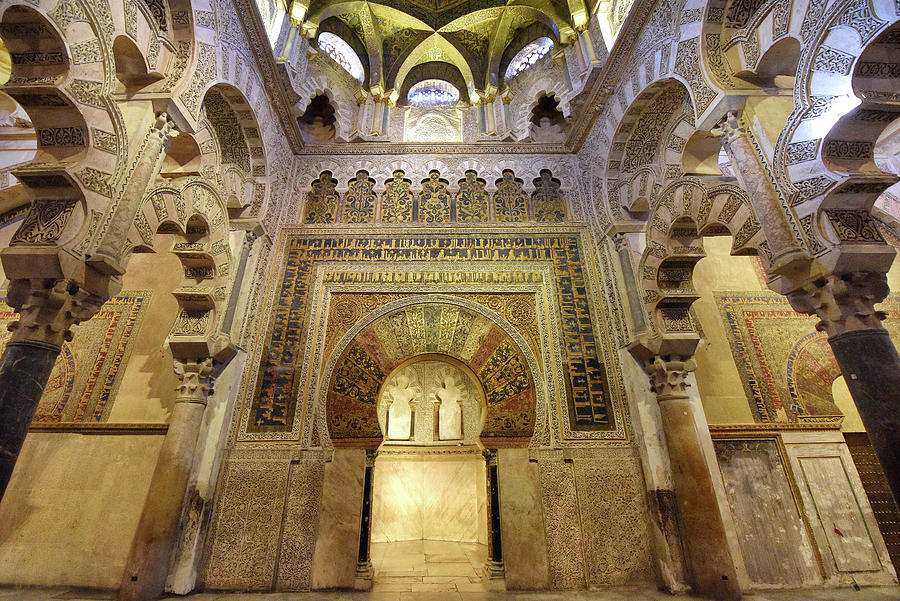
At what (x,y) coordinates should I click in order to perform the action: click on wooden cabinet. Please return your answer as a coordinate pair (x, y). Image resolution: width=900 pixels, height=601 pixels. Looking at the image, I should click on (840, 511).